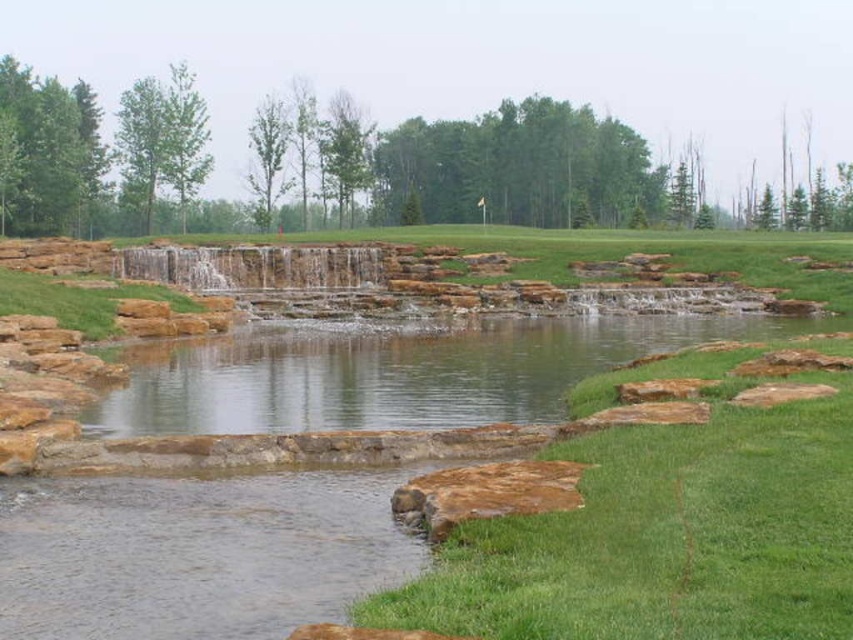
You are standing at the edge of the pond in the serene landscape scene. You see two points marked as point 1 and point 2. Point 1 is labeled as point (726, 605) and point 2 is labeled as point (100, 408). If you want to walk from point 1 to point 2, which direction should you move relative to your current position?

To move from point 1 to point 2, you should move backward since point 1 is in front of point 2 relative to your position at the edge of the pond.

You are standing at the edge of the pond in the image. Which direction should you walk to reach the green grass at lower center?

You should walk towards the lower center direction to reach the green grass at lower center.